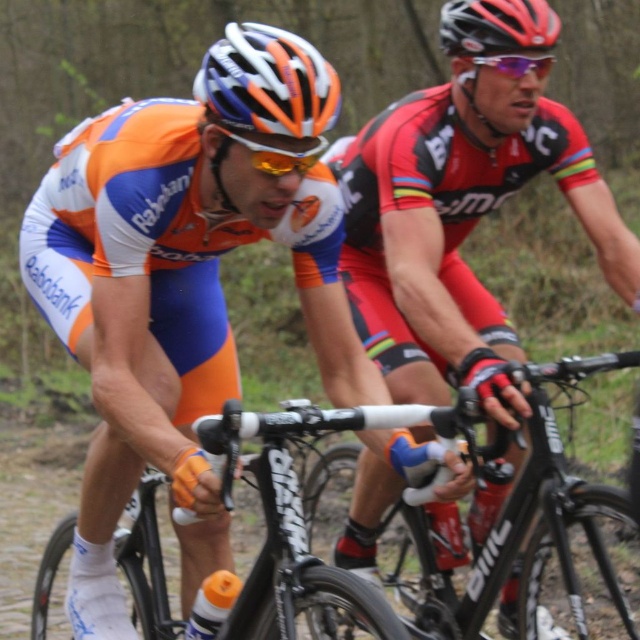
Can you confirm if black matte bicycle at center is shorter than black matte bicycle helmet at upper center?

Incorrect, black matte bicycle at center's height does not fall short of black matte bicycle helmet at upper center's.

Does black matte bicycle at center lie in front of black matte bicycle helmet at upper center?

Yes, black matte bicycle at center is in front of black matte bicycle helmet at upper center.

Does point (330, 632) lie in front of point (512, 40)?

No, it is behind (512, 40).

Where is `black matte bicycle at center`? The image size is (640, 640). black matte bicycle at center is located at coordinates (524, 529).

Who is taller, white matte bicycle handlebars at center or white matte bicycle helmet at upper center?

white matte bicycle handlebars at center

Looking at this image, does white matte bicycle handlebars at center have a smaller size compared to white matte bicycle helmet at upper center?

Actually, white matte bicycle handlebars at center might be larger than white matte bicycle helmet at upper center.

The height and width of the screenshot is (640, 640). What do you see at coordinates (289, 532) in the screenshot?
I see `white matte bicycle handlebars at center` at bounding box center [289, 532].

The height and width of the screenshot is (640, 640). Identify the location of white matte bicycle handlebars at center. (289, 532).

Between matte black jersey at center and white matte bicycle helmet at upper center, which one has less height?

With less height is white matte bicycle helmet at upper center.

How much distance is there between matte black jersey at center and white matte bicycle helmet at upper center?

They are 4.11 feet apart.

What are the coordinates of `matte black jersey at center` in the screenshot? It's located at (460, 221).

Where is `matte black jersey at center`? The height and width of the screenshot is (640, 640). matte black jersey at center is located at coordinates (460, 221).